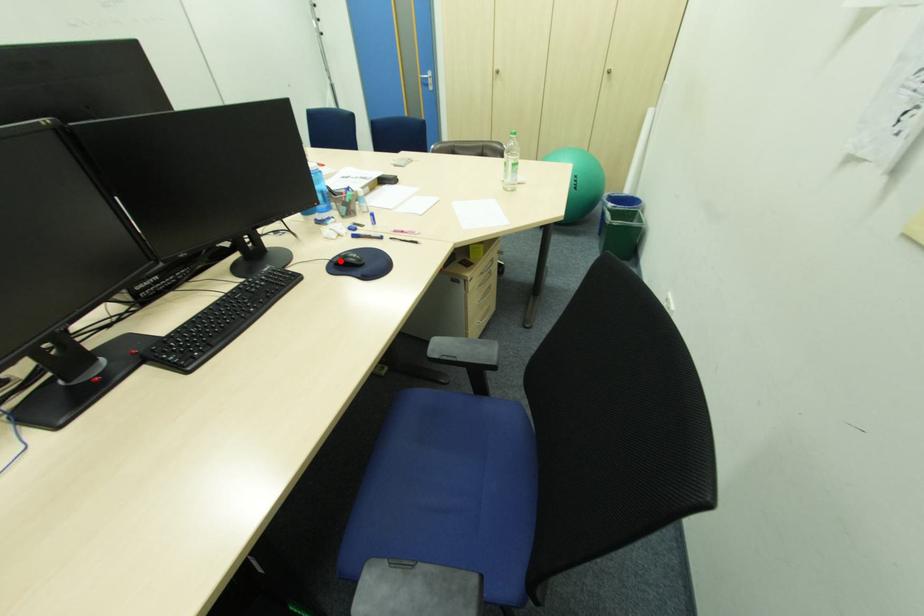
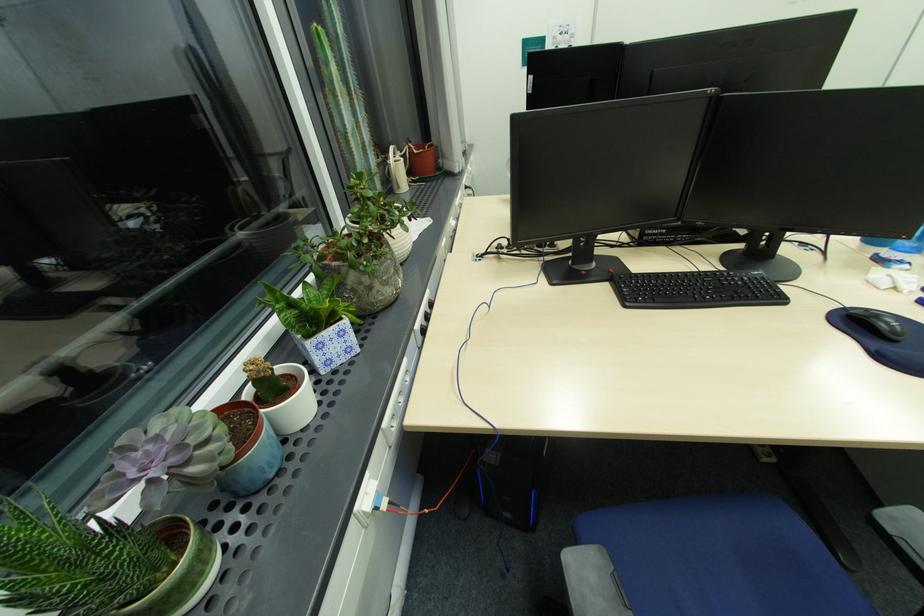
In the second image, find the point that corresponds to the highlighted location in the first image.

(857, 312)